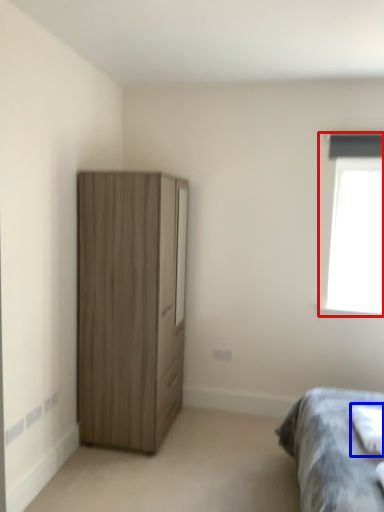
Question: Which point is further to the camera, window (highlighted by a red box) or sheet (highlighted by a blue box)?

Choices:
 (A) window
 (B) sheet

Answer: (A)